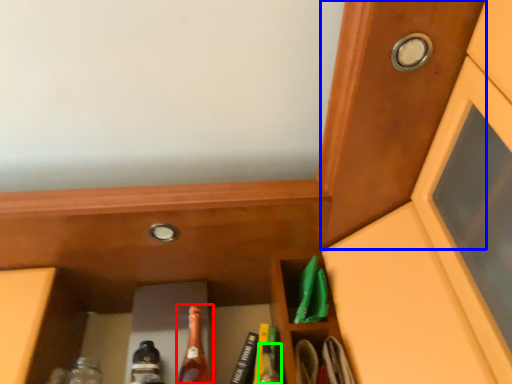
Question: Which object is positioned farthest from beer bottle (highlighted by a red box)? Select from door (highlighted by a blue box) and bottle (highlighted by a green box).

Choices:
 (A) door
 (B) bottle

Answer: (A)